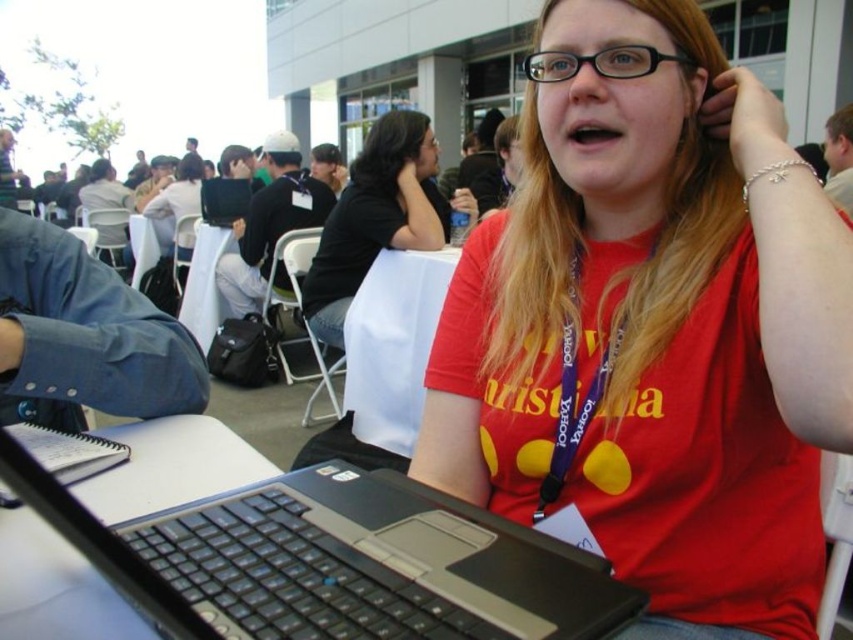
Between point (734, 244) and point (387, 118), which one is positioned in front?

Positioned in front is point (734, 244).

Who is higher up, matte red t-shirt at center or black matte shirt at center?

black matte shirt at center is higher up.

This screenshot has width=853, height=640. Identify the location of matte red t-shirt at center. (656, 330).

Find the location of a particular element. matte red t-shirt at center is located at coordinates (656, 330).

Does matte red t-shirt at center come in front of blue fabric lanyard at center?

Yes, matte red t-shirt at center is in front of blue fabric lanyard at center.

Who is taller, matte red t-shirt at center or blue fabric lanyard at center?

Standing taller between the two is matte red t-shirt at center.

Is point (753, 550) in front of point (567, 385)?

Yes, it is.

At what (x,y) coordinates should I click in order to perform the action: click on matte red t-shirt at center. Please return your answer as a coordinate pair (x, y). The width and height of the screenshot is (853, 640). Looking at the image, I should click on (656, 330).

Is point (457, 573) behind point (566, 445)?

No.

Between black plastic laptop at center and blue fabric lanyard at center, which one appears on the right side from the viewer's perspective?

From the viewer's perspective, blue fabric lanyard at center appears more on the right side.

Looking at this image, who is more forward, (x=413, y=608) or (x=576, y=340)?

Positioned in front is point (x=413, y=608).

Where is `black plastic laptop at center`? This screenshot has height=640, width=853. black plastic laptop at center is located at coordinates pyautogui.click(x=334, y=561).